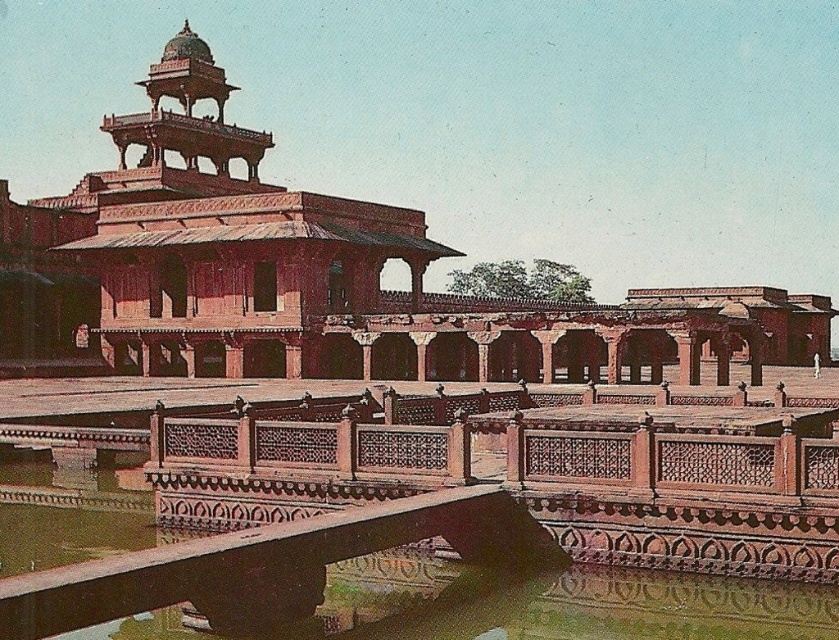
Question: Which object appears farthest from the camera in this image?

Choices:
 (A) smooth stone water at center
 (B) matte red stone palace at center

Answer: (B)

Question: Is matte red stone palace at center positioned behind smooth stone water at center?

Choices:
 (A) yes
 (B) no

Answer: (A)

Question: From the image, what is the correct spatial relationship of matte red stone palace at center in relation to smooth stone water at center?

Choices:
 (A) left
 (B) right

Answer: (B)

Question: Which point is closer to the camera?

Choices:
 (A) matte red stone palace at center
 (B) smooth stone water at center

Answer: (B)

Question: Can you confirm if matte red stone palace at center is thinner than smooth stone water at center?

Choices:
 (A) no
 (B) yes

Answer: (A)